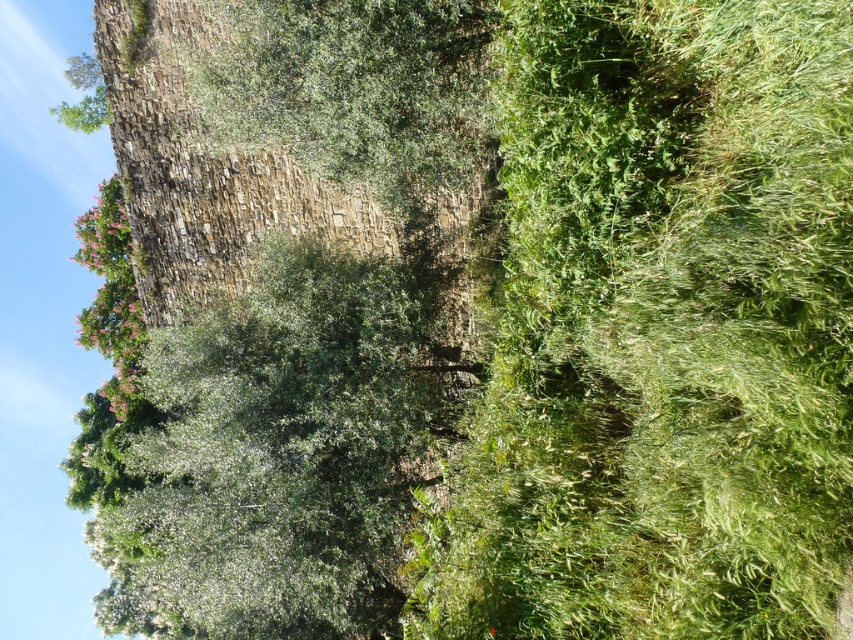
Question: Does green leafy tree at upper center have a smaller size compared to pink matte tree at upper left?

Choices:
 (A) yes
 (B) no

Answer: (A)

Question: Among these points, which one is farthest from the camera?

Choices:
 (A) (544, 435)
 (B) (459, 45)
 (C) (311, 580)
 (D) (83, 317)

Answer: (D)

Question: Which of the following is the farthest from the observer?

Choices:
 (A) (123, 236)
 (B) (508, 236)
 (C) (190, 337)
 (D) (253, 140)

Answer: (A)

Question: Is green leafy tree at center to the right of pink matte tree at upper left from the viewer's perspective?

Choices:
 (A) no
 (B) yes

Answer: (B)

Question: Where is green leafy tree at center located in relation to pink matte tree at upper left in the image?

Choices:
 (A) right
 (B) left

Answer: (A)

Question: Which is farther from the pink matte tree at upper left?

Choices:
 (A) green leafy tree at upper center
 (B) green leafy tree at center

Answer: (A)